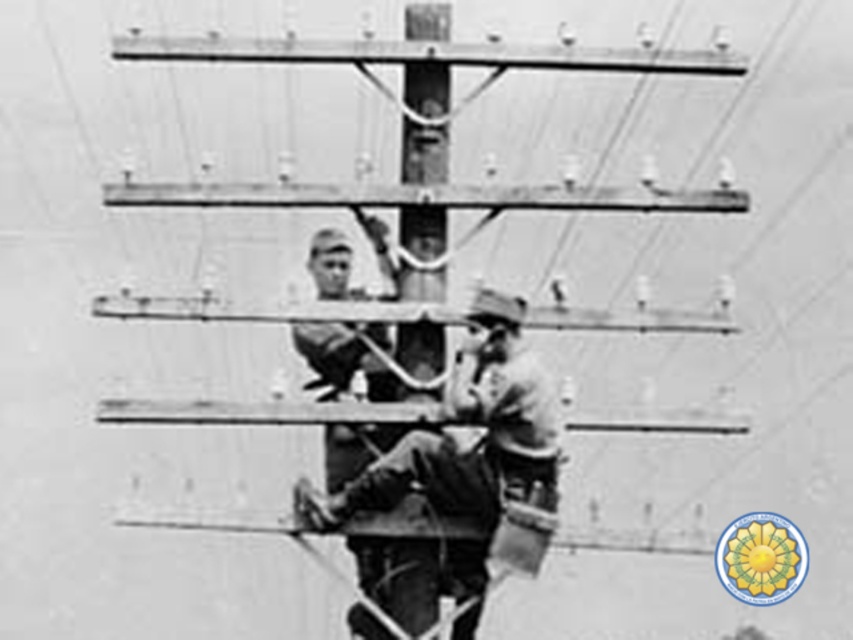
Can you confirm if smooth leather gloves at center is smaller than smooth wood telegraph pole at center?

Actually, smooth leather gloves at center might be larger than smooth wood telegraph pole at center.

Which is behind, point (541, 417) or point (415, 276)?

The point (415, 276) is behind.

You are a GUI agent. You are given a task and a screenshot of the screen. Output one action in this format:
    pyautogui.click(x=<x>, y=<y>)
    Task: Click on the smooth leather gloves at center
    
    Given the screenshot: What is the action you would take?
    pyautogui.click(x=463, y=420)